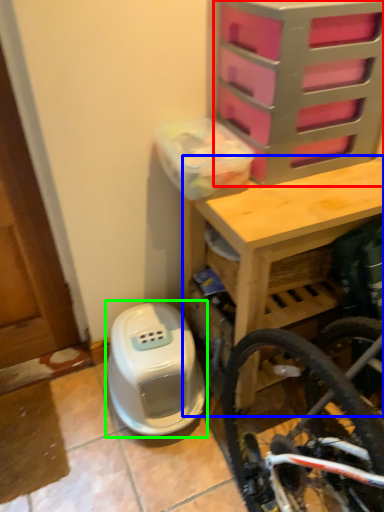
Question: Which is farther away from drawer (highlighted by a red box)? table (highlighted by a blue box) or water heater (highlighted by a green box)?

Choices:
 (A) table
 (B) water heater

Answer: (B)